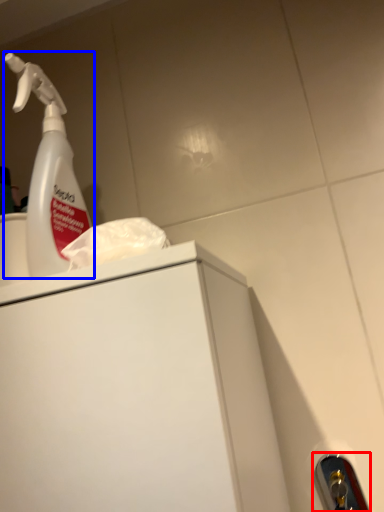
Question: Among these objects, which one is farthest to the camera, door handle (highlighted by a red box) or cleaning product (highlighted by a blue box)?

Choices:
 (A) door handle
 (B) cleaning product

Answer: (A)